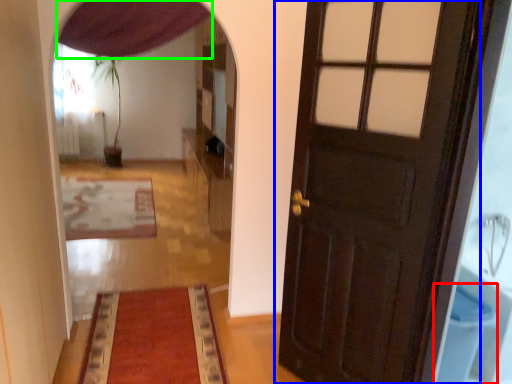
Question: Which object is positioned farthest from toilet bowl (highlighted by a red box)? Select from door (highlighted by a blue box) and curtain (highlighted by a green box).

Choices:
 (A) door
 (B) curtain

Answer: (B)